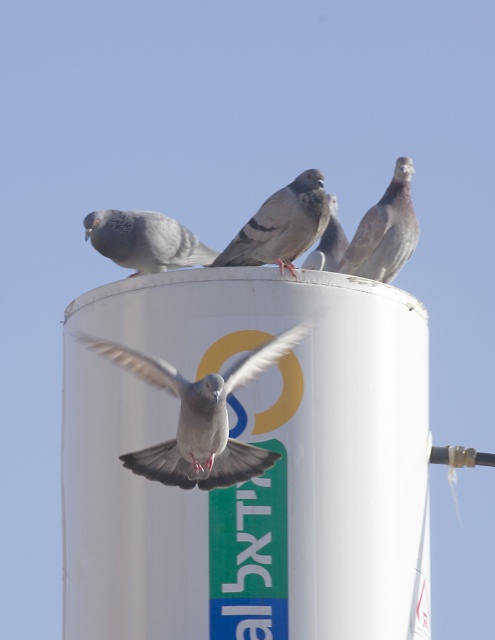
Where is `gray matte bird at center`? This screenshot has height=640, width=495. gray matte bird at center is located at coordinates [x=198, y=416].

Does gray matte bird at center have a lesser height compared to rusty feathered pigeon at upper right?

Yes.

Locate an element on the screen. Image resolution: width=495 pixels, height=640 pixels. gray matte bird at center is located at coordinates (198, 416).

In the scene shown: Is gray feathered pigeon at center positioned in front of gray matte pigeon at center?

Yes, it is.

Between gray feathered pigeon at center and gray matte pigeon at center, which one is positioned lower?

gray feathered pigeon at center

I want to click on gray feathered pigeon at center, so click(282, 225).

Is the position of gray matte bird at center more distant than that of gray matte pigeon at upper left?

No, it is not.

Does point (157, 362) come in front of point (182, 234)?

Yes, it is in front of point (182, 234).

You are a GUI agent. You are given a task and a screenshot of the screen. Output one action in this format:
    pyautogui.click(x=<x>, y=<y>)
    Task: Click on the gray matte bird at center
    The height and width of the screenshot is (640, 495).
    Given the screenshot: What is the action you would take?
    pyautogui.click(x=198, y=416)